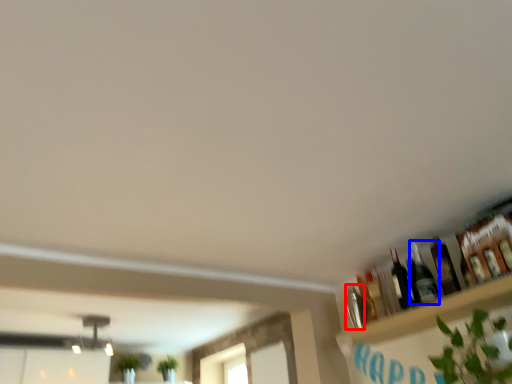
Question: Among these objects, which one is nearest to the camera, bottle (highlighted by a red box) or bottle (highlighted by a blue box)?

Choices:
 (A) bottle
 (B) bottle

Answer: (B)